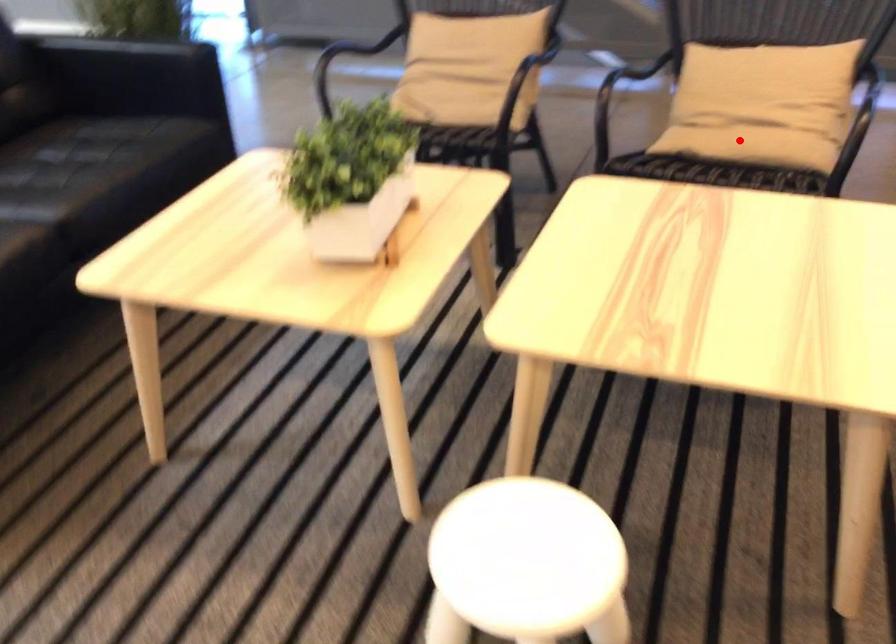
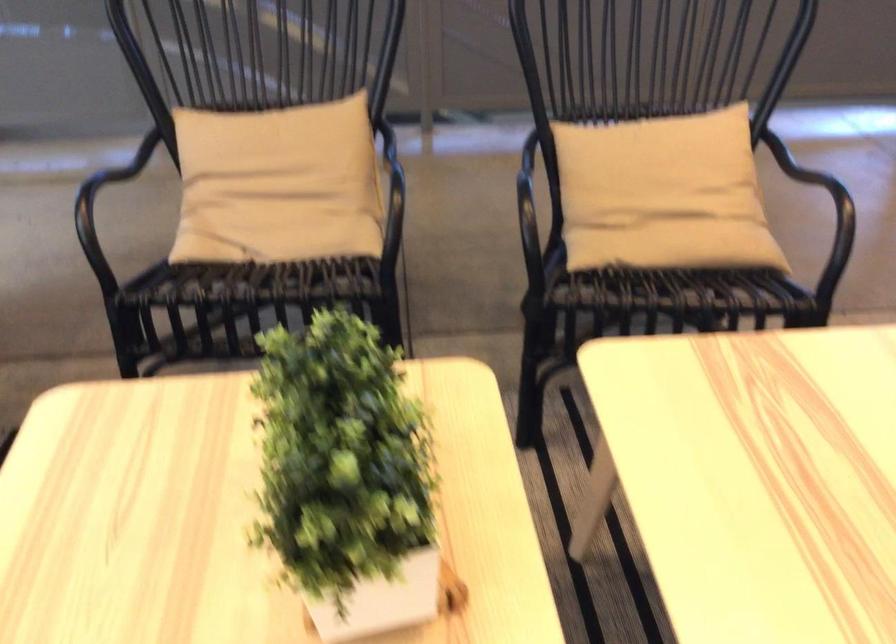
Question: I am providing you with two images of the same scene from different viewpoints. Given a red point in image1, look at the same physical point in image2. Is it:

Choices:
 (A) Closer to the viewpoint
 (B) Farther from the viewpoint

Answer: (A)